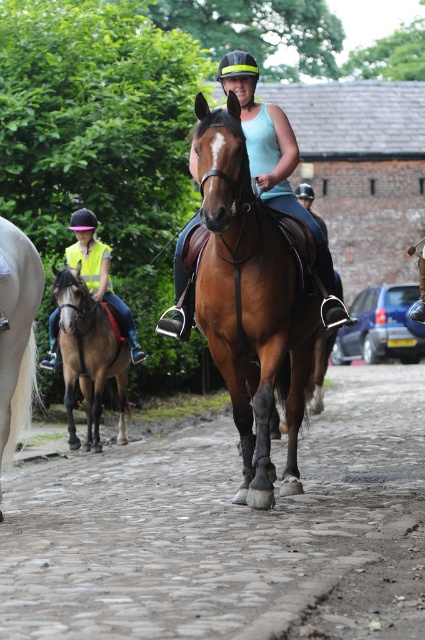
How much distance is there between brown glossy horse at left and white glossy horse at left?

They are 3.44 meters apart.

Is brown glossy horse at left smaller than white glossy horse at left?

No.

Is point (78, 308) behind point (2, 280)?

That is True.

Find the location of a particular element. brown glossy horse at left is located at coordinates (88, 355).

Between point (184, 278) and point (70, 428), which one is positioned in front?

Point (184, 278) is in front.

Is matte brown horse at center below brown glossy horse at left?

Actually, matte brown horse at center is above brown glossy horse at left.

Measure the distance between matte brown horse at center and camera.

matte brown horse at center is 7.30 meters away from camera.

Image resolution: width=425 pixels, height=640 pixels. Find the location of `matte brown horse at center`. matte brown horse at center is located at coordinates (272, 152).

Does point (274, 477) lie behind point (184, 339)?

No, (274, 477) is closer to viewer.

Can you confirm if brown glossy horse at center is thinner than matte brown horse at center?

In fact, brown glossy horse at center might be wider than matte brown horse at center.

Is point (195, 104) farther from viewer compared to point (331, 276)?

No.

Locate an element on the screen. brown glossy horse at center is located at coordinates (249, 305).